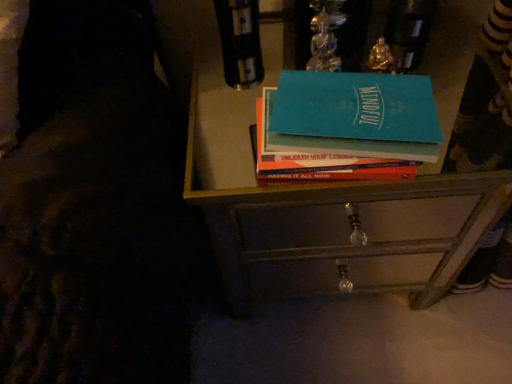
Question: Is the position of metallic drawer at center less distant than that of teal matte book at center?

Choices:
 (A) no
 (B) yes

Answer: (A)

Question: Does metallic drawer at center have a lesser height compared to teal matte book at center?

Choices:
 (A) yes
 (B) no

Answer: (B)

Question: From the image's perspective, is metallic drawer at center above teal matte book at center?

Choices:
 (A) no
 (B) yes

Answer: (A)

Question: From a real-world perspective, is metallic drawer at center physically below teal matte book at center?

Choices:
 (A) no
 (B) yes

Answer: (B)

Question: Considering the relative sizes of metallic drawer at center and teal matte book at center in the image provided, is metallic drawer at center smaller than teal matte book at center?

Choices:
 (A) yes
 (B) no

Answer: (B)

Question: From a real-world perspective, relative to teal matte book at center, is metallic drawer at center vertically above or below?

Choices:
 (A) below
 (B) above

Answer: (A)

Question: Based on their sizes in the image, would you say metallic drawer at center is bigger or smaller than teal matte book at center?

Choices:
 (A) small
 (B) big

Answer: (A)

Question: Is metallic drawer at center wider or thinner than teal matte book at center?

Choices:
 (A) wide
 (B) thin

Answer: (B)

Question: Is point (301, 279) closer or farther from the camera than point (293, 155)?

Choices:
 (A) closer
 (B) farther

Answer: (B)

Question: In terms of height, does metallic drawer at center look taller or shorter compared to metallic drawer at center?

Choices:
 (A) tall
 (B) short

Answer: (B)

Question: From a real-world perspective, is metallic drawer at center above or below metallic drawer at center?

Choices:
 (A) below
 (B) above

Answer: (A)

Question: Is point (364, 258) positioned closer to the camera than point (192, 196)?

Choices:
 (A) farther
 (B) closer

Answer: (A)

Question: From the image's perspective, relative to metallic drawer at center, is metallic drawer at center above or below?

Choices:
 (A) below
 (B) above

Answer: (A)

Question: Considering the positions of metallic drawer at center and metallic drawer at center in the image, is metallic drawer at center taller or shorter than metallic drawer at center?

Choices:
 (A) short
 (B) tall

Answer: (B)

Question: Based on their sizes in the image, would you say metallic drawer at center is bigger or smaller than metallic drawer at center?

Choices:
 (A) big
 (B) small

Answer: (A)